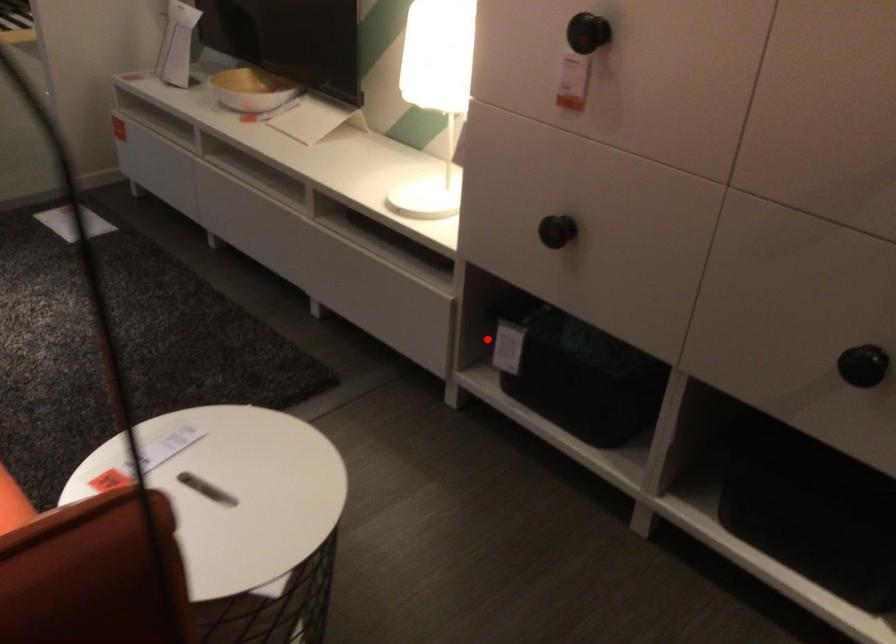
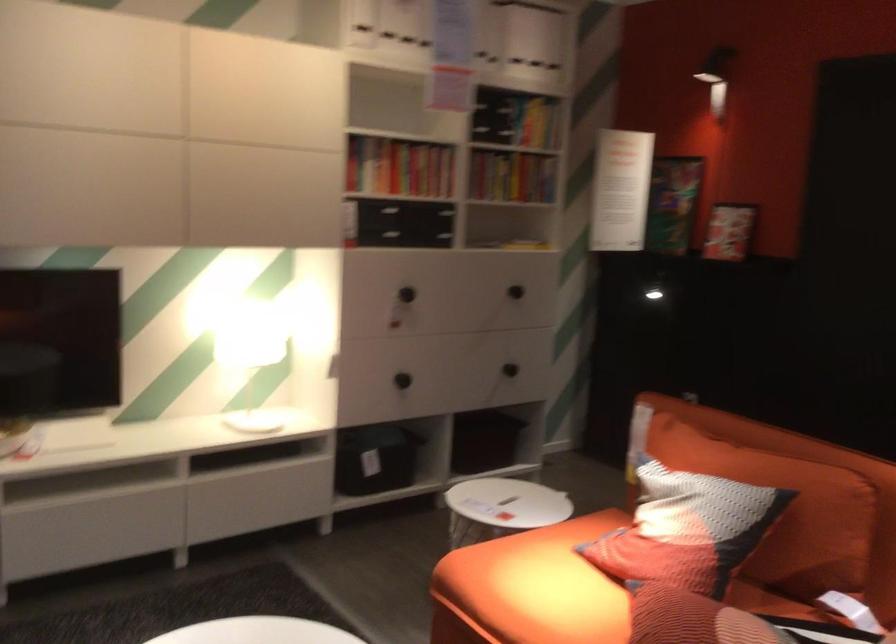
Question: I am providing you with two images of the same scene from different viewpoints. In image1, a red point is highlighted. Considering the same 3D point in image2, which of the following is correct?

Choices:
 (A) It is closer
 (B) It is farther

Answer: (B)